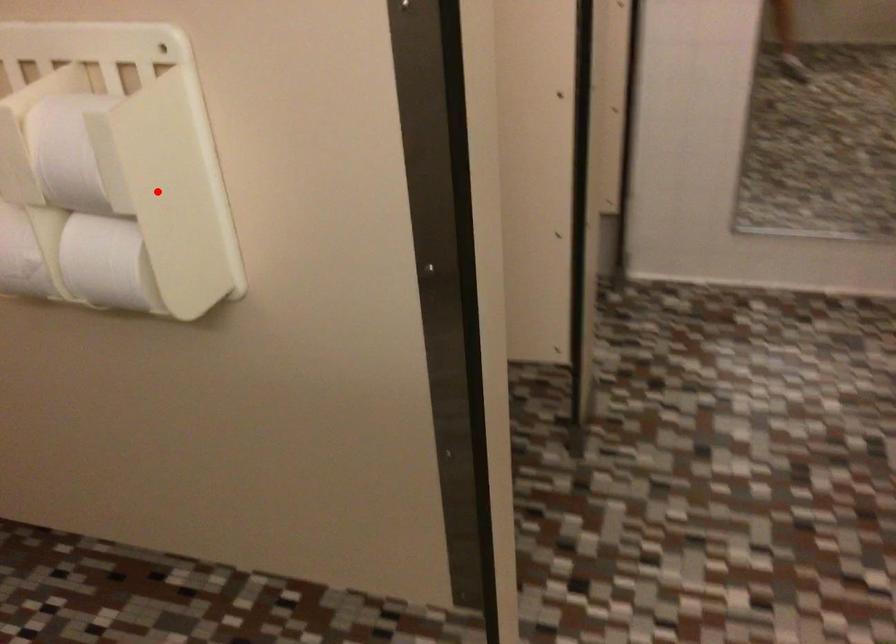
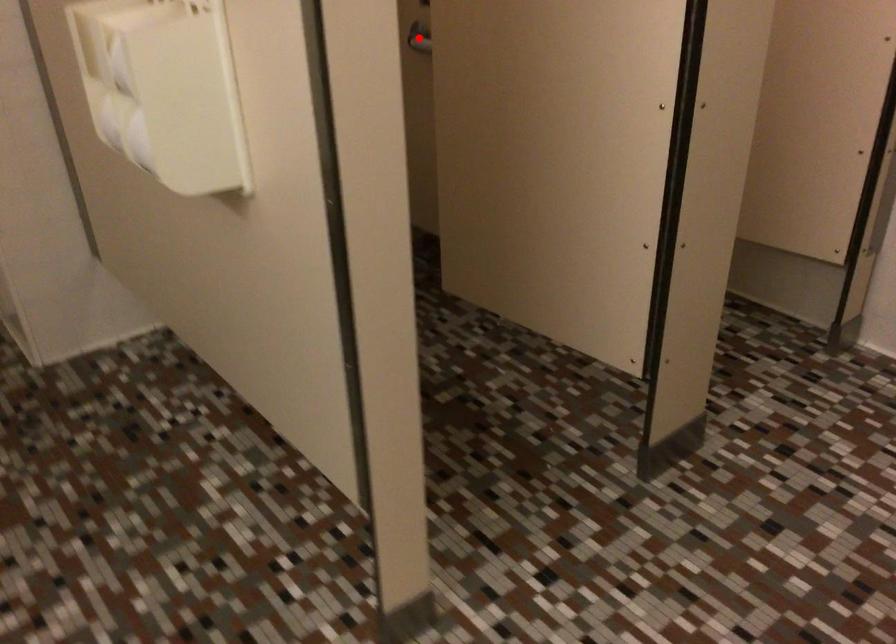
I am providing you with two images of the same scene from different viewpoints. A red point is marked on the first image and another point is marked on the second image. Are the points marked in image1 and image2 representing the same 3D position?

No